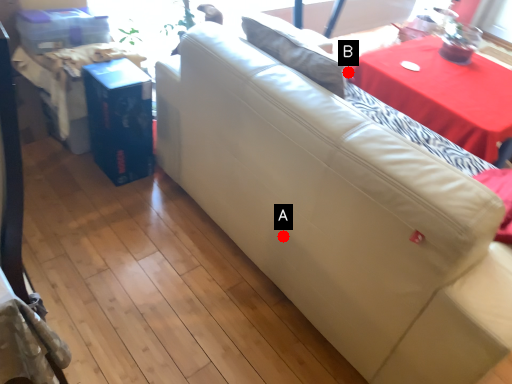
Question: Two points are circled on the image, labeled by A and B beside each circle. Among these points, which one is farthest from the camera?

Choices:
 (A) A is further
 (B) B is further

Answer: (B)